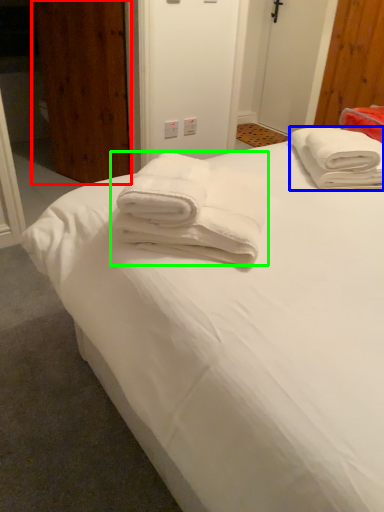
Question: Which is nearer to the door (highlighted by a red box)? towel (highlighted by a blue box) or towel (highlighted by a green box).

Choices:
 (A) towel
 (B) towel

Answer: (A)